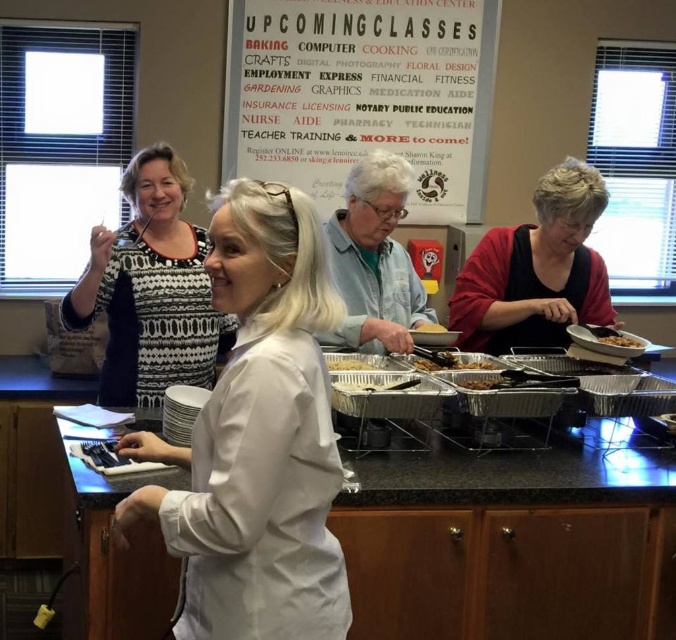
What do you see at coordinates (452, 362) in the screenshot? I see `shiny metallic tray at center` at bounding box center [452, 362].

Where is `shiny metallic tray at center`? The height and width of the screenshot is (640, 676). shiny metallic tray at center is located at coordinates (452, 362).

Does point (443, 365) come in front of point (324, 358)?

No.

Locate an element on the screen. The height and width of the screenshot is (640, 676). shiny metallic tray at center is located at coordinates (452, 362).

Is black granite counter at center further to the viewer compared to patterned fabric sweater at upper left?

That is False.

Is black granite counter at center taller than patterned fabric sweater at upper left?

Incorrect, black granite counter at center's height is not larger of patterned fabric sweater at upper left's.

In order to click on black granite counter at center in this screenshot , I will do click(504, 536).

You are a GUI agent. You are given a task and a screenshot of the screen. Output one action in this format:
    pyautogui.click(x=<x>, y=<y>)
    Task: Click on the black granite counter at center
    The height and width of the screenshot is (640, 676).
    Given the screenshot: What is the action you would take?
    pyautogui.click(x=504, y=536)

What do you see at coordinates (504, 536) in the screenshot?
I see `black granite counter at center` at bounding box center [504, 536].

Is point (656, 452) farther from camera compared to point (333, 365)?

No, it is not.

Does point (122, 588) lie behind point (327, 358)?

No.

Locate an element on the screen. black granite counter at center is located at coordinates (504, 536).